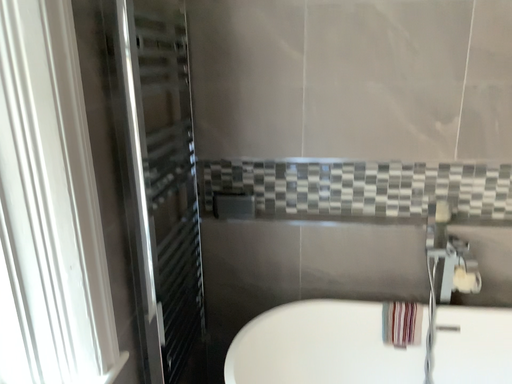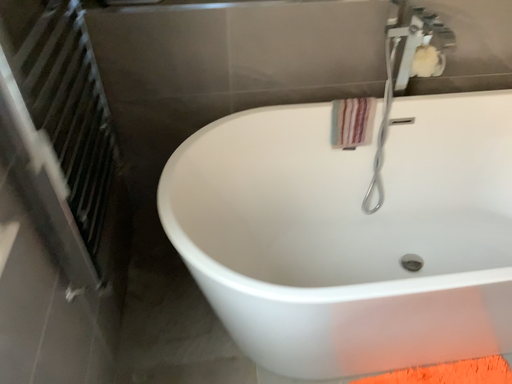
Question: How did the camera likely rotate when shooting the video?

Choices:
 (A) rotated downward
 (B) rotated upward

Answer: (A)